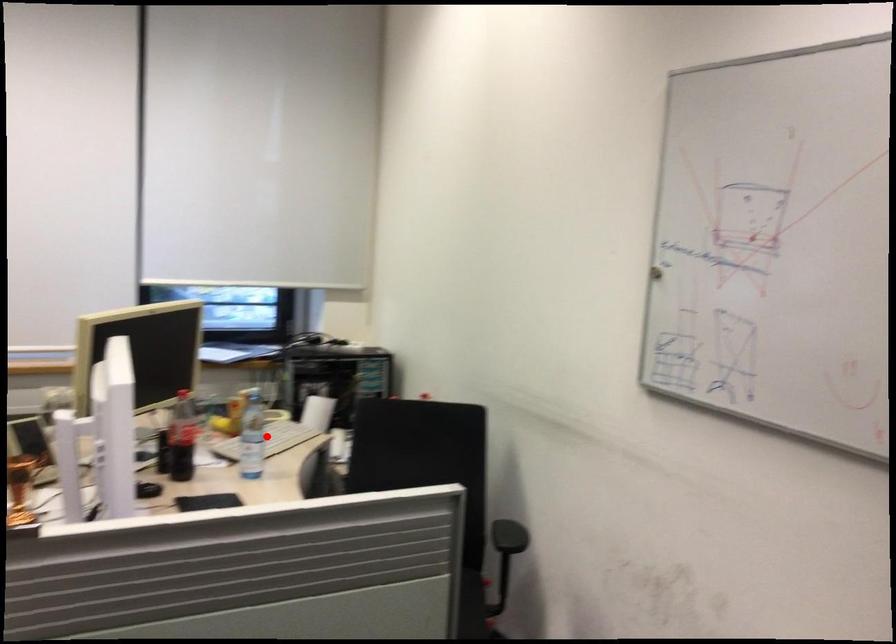
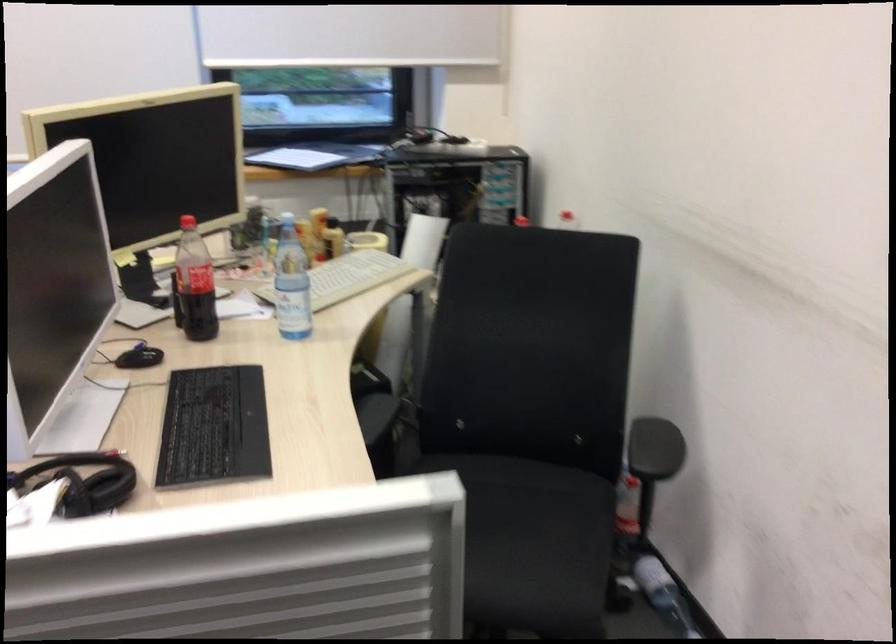
Question: I am providing you with two images of the same scene from different viewpoints. Given a red point in image1, look at the same physical point in image2. Is it:

Choices:
 (A) Closer to the viewpoint
 (B) Farther from the viewpoint

Answer: (A)